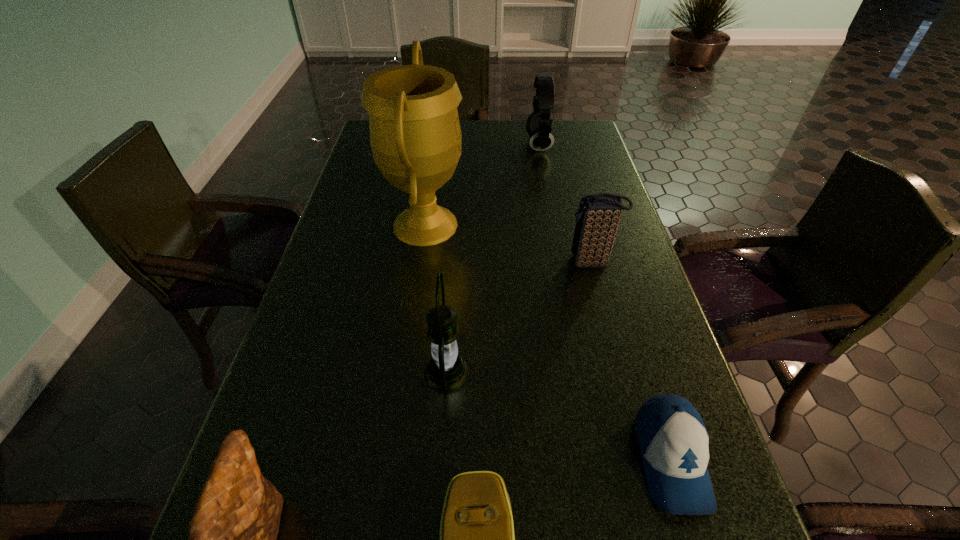
Where is `vacant area situated 0.360m on the ear cups of the farthest object`? vacant area situated 0.360m on the ear cups of the farthest object is located at coordinates (417, 145).

This screenshot has height=540, width=960. In order to click on vacant point located 0.160m with the zip open on the farthest clutch bag in this screenshot , I will do `click(500, 262)`.

Locate an element on the screen. free space located 0.060m with the zip open on the farthest clutch bag is located at coordinates tap(541, 262).

In order to click on free point located 0.310m with the zip open on the farthest clutch bag in this screenshot , I will do `click(437, 262)`.

Image resolution: width=960 pixels, height=540 pixels. Identify the location of object that is at the far edge. (538, 125).

Where is `object that is at the left edge`? This screenshot has width=960, height=540. object that is at the left edge is located at coordinates (415, 136).

The width and height of the screenshot is (960, 540). In order to click on earphone that is at the right edge in this screenshot , I will do `click(538, 125)`.

You are a GUI agent. You are given a task and a screenshot of the screen. Output one action in this format:
    pyautogui.click(x=<x>, y=<y>)
    Task: Click on the clutch bag that is at the right edge
    This screenshot has height=540, width=960.
    Given the screenshot: What is the action you would take?
    pyautogui.click(x=598, y=217)

Identify the location of baseball cap located in the right edge section of the desktop. The height and width of the screenshot is (540, 960). (672, 438).

The image size is (960, 540). Identify the location of object that is at the far right corner. (538, 125).